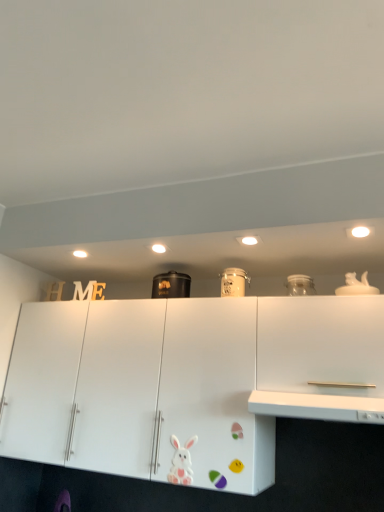
In order to click on black matte container at center, marked as the first appliance in a back-to-front arrangement in this screenshot , I will do `click(171, 285)`.

Describe the element at coordinates (321, 345) in the screenshot. I see `white matte cabinet at right` at that location.

Image resolution: width=384 pixels, height=512 pixels. What do you see at coordinates (181, 462) in the screenshot?
I see `white matte rabbit at lower center` at bounding box center [181, 462].

Find the location of a particular element. white glossy counter top at center is located at coordinates (317, 406).

At what (x,y) coordinates should I click in order to perform the action: click on black matte container at center, which is the 1th appliance in left-to-right order. Please return your answer as a coordinate pair (x, y). This screenshot has width=384, height=512. Looking at the image, I should click on (171, 285).

Is matte white jar at center, positioned as the second appliance in back-to-front order, bigger than white matte rabbit at lower center?

Yes, matte white jar at center, positioned as the second appliance in back-to-front order, is bigger than white matte rabbit at lower center.

Between matte white jar at center, placed as the first appliance when sorted from right to left, and white matte rabbit at lower center, which one appears on the left side from the viewer's perspective?

Positioned to the left is white matte rabbit at lower center.

Would you consider matte white jar at center, positioned as the second appliance in back-to-front order, to be distant from white matte rabbit at lower center?

matte white jar at center, positioned as the second appliance in back-to-front order, is near white matte rabbit at lower center, not far away.

Looking at this image, can you confirm if white matte rabbit at lower center is positioned to the right of white glossy counter top at center?

No, white matte rabbit at lower center is not to the right of white glossy counter top at center.

What's the angular difference between white matte rabbit at lower center and white glossy counter top at center's facing directions?

The angle between the facing direction of white matte rabbit at lower center and the facing direction of white glossy counter top at center is 1.96 degrees.

Could you tell me if white matte rabbit at lower center is turned towards white glossy counter top at center?

No, white matte rabbit at lower center is not facing towards white glossy counter top at center.

Is white matte cabinet at right far from matte white jar at center, positioned as the second appliance in back-to-front order?

Actually, white matte cabinet at right and matte white jar at center, positioned as the second appliance in back-to-front order, are a little close together.

Can you confirm if white matte cabinet at right is taller than matte white jar at center, placed as the first appliance when sorted from right to left?

Yes, white matte cabinet at right is taller than matte white jar at center, placed as the first appliance when sorted from right to left.

Considering the relative sizes of white matte cabinet at right and matte white jar at center, which is the 2th appliance in left-to-right order, in the image provided, is white matte cabinet at right wider than matte white jar at center, which is the 2th appliance in left-to-right order,?

Yes, white matte cabinet at right is wider than matte white jar at center, which is the 2th appliance in left-to-right order.

Is matte white jar at center, positioned as the second appliance in back-to-front order, oriented towards white matte cabinet at right?

No.

Is matte white jar at center, placed as the first appliance when sorted from front to back, not within white matte cabinet at right?

Yes, matte white jar at center, placed as the first appliance when sorted from front to back, is outside of white matte cabinet at right.

Is matte white jar at center, positioned as the second appliance in back-to-front order, wider or thinner than white matte cabinet at right?

In the image, matte white jar at center, positioned as the second appliance in back-to-front order, appears to be more narrow than white matte cabinet at right.

Considering the positions of points (236, 268) and (343, 364), is point (236, 268) farther from camera compared to point (343, 364)?

Yes, point (236, 268) is behind point (343, 364).

Which point is more distant from viewer, (262, 400) or (187, 443)?

The point (187, 443) is behind.

From a real-world perspective, does white glossy counter top at center stand above white matte rabbit at lower center?

Yes.

Is white glossy counter top at center aimed at white matte rabbit at lower center?

No, white glossy counter top at center does not turn towards white matte rabbit at lower center.

Where is `the 2nd appliance to the left when counting from the white glossy counter top at center`? the 2nd appliance to the left when counting from the white glossy counter top at center is located at coordinates (171, 285).

Is white glossy counter top at center positioned in front of black matte container at center, marked as the first appliance in a back-to-front arrangement?

Yes, white glossy counter top at center is closer to the viewer.

Could you tell me if white glossy counter top at center is facing black matte container at center, marked as the first appliance in a back-to-front arrangement?

No.

Who is shorter, white glossy counter top at center or black matte container at center, marked as the first appliance in a back-to-front arrangement?

white glossy counter top at center is shorter.

Considering the relative sizes of white matte rabbit at lower center and matte white jar at center, which is the 2th appliance in left-to-right order, in the image provided, is white matte rabbit at lower center thinner than matte white jar at center, which is the 2th appliance in left-to-right order,?

Yes, white matte rabbit at lower center is thinner than matte white jar at center, which is the 2th appliance in left-to-right order.

From a real-world perspective, which object rests below the other?

From a 3D spatial view, white matte rabbit at lower center is below.

Is white matte rabbit at lower center aimed at matte white jar at center, placed as the first appliance when sorted from front to back?

A: No.

The image size is (384, 512). Find the location of `the 2nd appliance above the white matte rabbit at lower center (from the image's perspective)`. the 2nd appliance above the white matte rabbit at lower center (from the image's perspective) is located at coordinates (233, 282).

The image size is (384, 512). Identify the location of counter top located in front of the white matte rabbit at lower center. (317, 406).

When comparing their distances from white glossy counter top at center, does white matte cabinet at right or matte white jar at center, positioned as the second appliance in back-to-front order, seem closer?

white matte cabinet at right.

When comparing their distances from white matte cabinet at right, does white glossy counter top at center or matte white jar at center, placed as the first appliance when sorted from front to back, seem closer?

white glossy counter top at center lies closer to white matte cabinet at right than the other object.

Estimate the real-world distances between objects in this image. Which object is further from black matte container at center, marked as the first appliance in a back-to-front arrangement, white matte cabinet at right or white glossy counter top at center?

white glossy counter top at center.

Estimate the real-world distances between objects in this image. Which object is further from black matte container at center, acting as the 2th appliance starting from the front, matte white jar at center, positioned as the second appliance in back-to-front order, or white matte cabinet at right?

A: white matte cabinet at right lies further to black matte container at center, acting as the 2th appliance starting from the front, than the other object.

Based on their spatial positions, is matte white jar at center, placed as the first appliance when sorted from right to left, or white glossy counter top at center closer to black matte container at center, which is the 1th appliance in left-to-right order?

Among the two, matte white jar at center, placed as the first appliance when sorted from right to left, is located nearer to black matte container at center, which is the 1th appliance in left-to-right order.

Based on their spatial positions, is black matte container at center, marked as the first appliance in a back-to-front arrangement, or white matte cabinet at right further from white glossy counter top at center?

black matte container at center, marked as the first appliance in a back-to-front arrangement, lies further to white glossy counter top at center than the other object.

Based on their spatial positions, is white matte rabbit at lower center or white glossy counter top at center further from white matte cabinet at right?

white matte rabbit at lower center lies further to white matte cabinet at right than the other object.

When comparing their distances from matte white jar at center, which is the 2th appliance in left-to-right order, does white matte rabbit at lower center or white matte cabinet at right seem closer?

The object closer to matte white jar at center, which is the 2th appliance in left-to-right order, is white matte cabinet at right.

I want to click on counter top between black matte container at center, which is the second appliance in right-to-left order, and white matte cabinet at right, so click(x=317, y=406).

Locate an element on the screen. The height and width of the screenshot is (512, 384). cabinetry that lies between matte white jar at center, placed as the first appliance when sorted from right to left, and white matte rabbit at lower center from top to bottom is located at coordinates (321, 345).

This screenshot has width=384, height=512. I want to click on appliance between matte white jar at center, positioned as the second appliance in back-to-front order, and white matte rabbit at lower center in the up-down direction, so click(x=171, y=285).

Locate an element on the screen. appliance situated between black matte container at center, which is the second appliance in right-to-left order, and white matte cabinet at right from left to right is located at coordinates (233, 282).